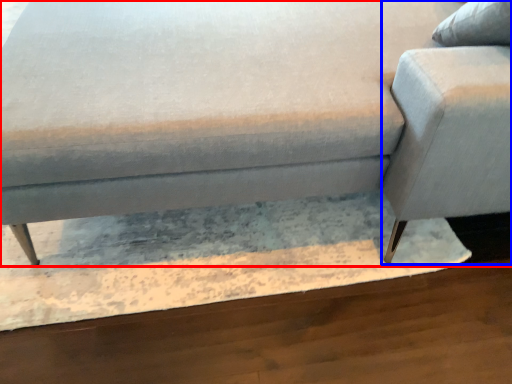
Question: Which of the following is the farthest to the observer, studio couch (highlighted by a red box) or swivel chair (highlighted by a blue box)?

Choices:
 (A) studio couch
 (B) swivel chair

Answer: (B)